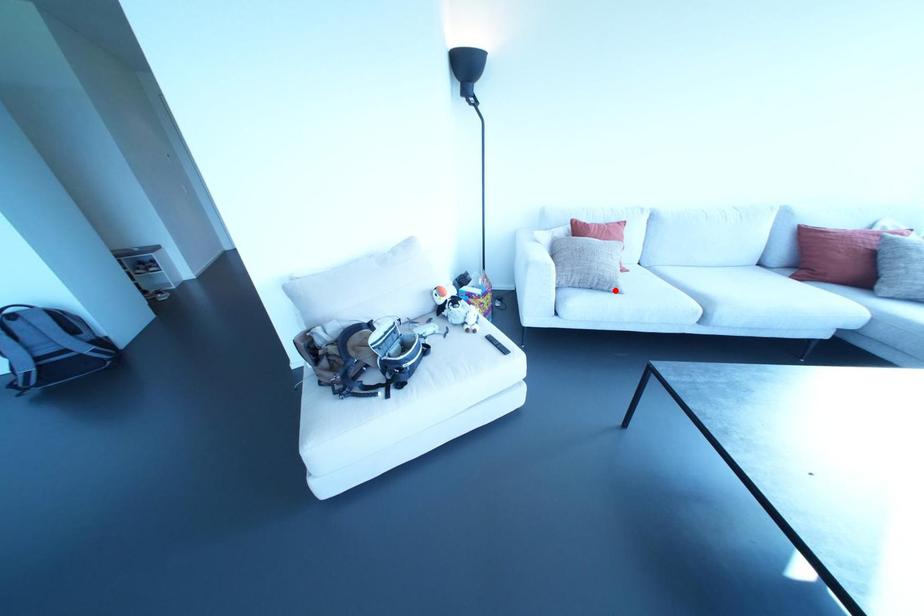
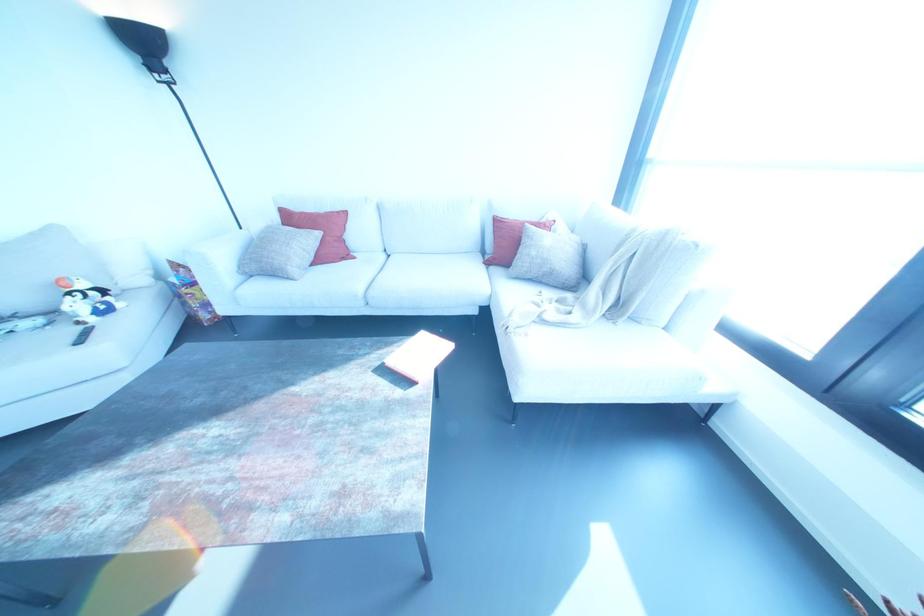
Find the pixel in the second image that matches the highlighted location in the first image.

(287, 277)